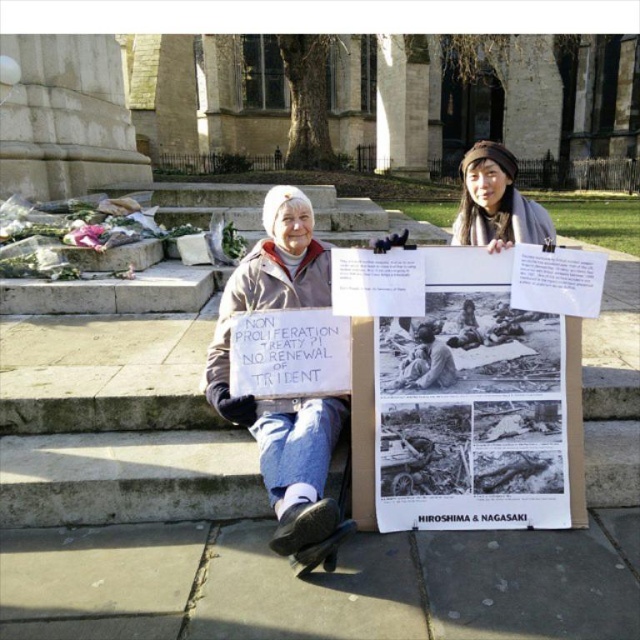
What is the 2D coordinate of the black paper poster at center?

The black paper poster at center is located at the 2D coordinate point of (476, 404).

You are a photographer standing in front of the historic building. You want to take a photo that includes both the black paper poster at center and the brown woolen hat at upper center. Which object should you focus on first to ensure both are in clear view?

The black paper poster at center is closer to the viewer than the brown woolen hat at upper center, so you should focus on the black paper poster at center first to ensure depth of field captures both objects clearly.

Based on the photo, you are standing in the public square and want to find the denim jacket at center. According to the coordinates provided, where should you look relative to the older woman?

The denim jacket at center is located at coordinates point 0.623 on the x axis and 0.447 on the y axis, so you should look to the right side of the older woman since the x coordinate is higher than 0.5.